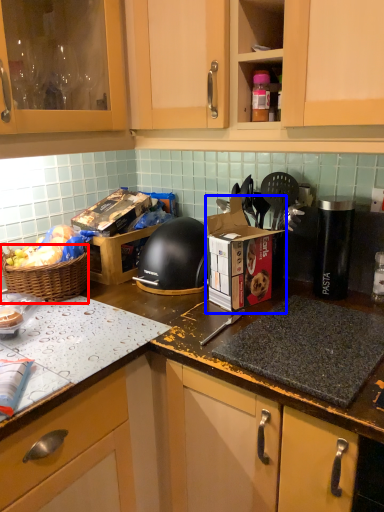
Question: Which of the following is the farthest to the observer, picnic basket (highlighted by a red box) or cardboard box (highlighted by a blue box)?

Choices:
 (A) picnic basket
 (B) cardboard box

Answer: (A)